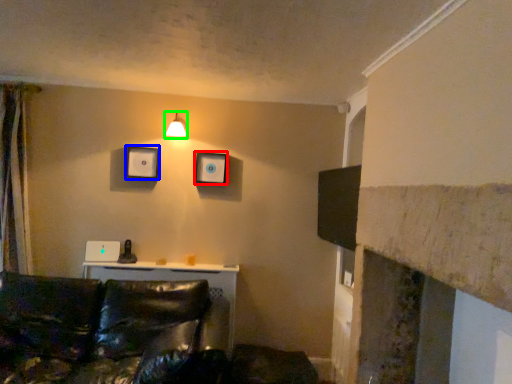
Question: Which object is positioned closest to picture frame (highlighted by a red box)? Select from picture frame (highlighted by a blue box) and light fixture (highlighted by a green box).

Choices:
 (A) picture frame
 (B) light fixture

Answer: (B)